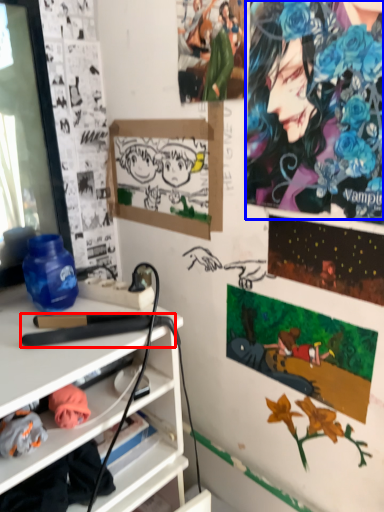
Question: Which object is closer to the camera taking this photo, equipment (highlighted by a red box) or person (highlighted by a blue box)?

Choices:
 (A) equipment
 (B) person

Answer: (B)